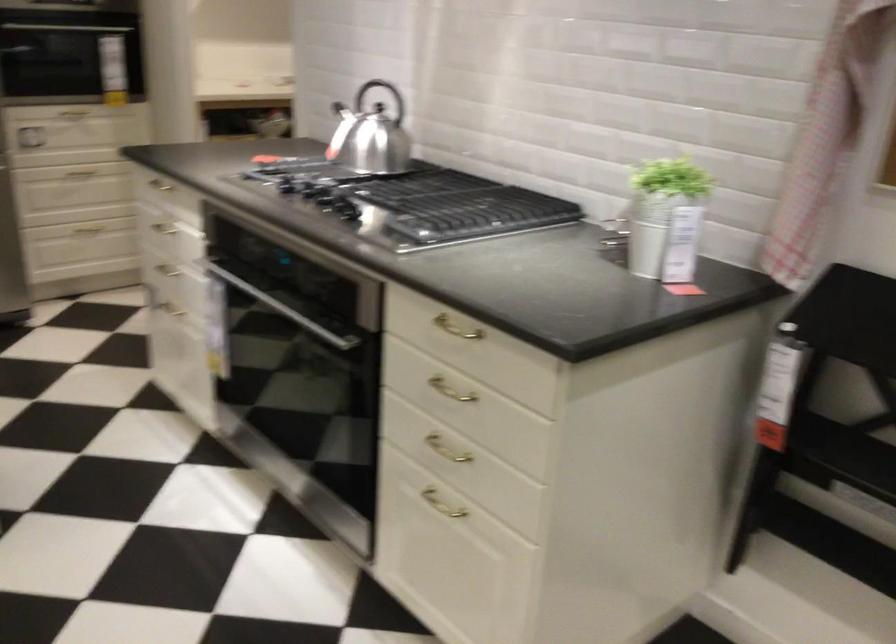
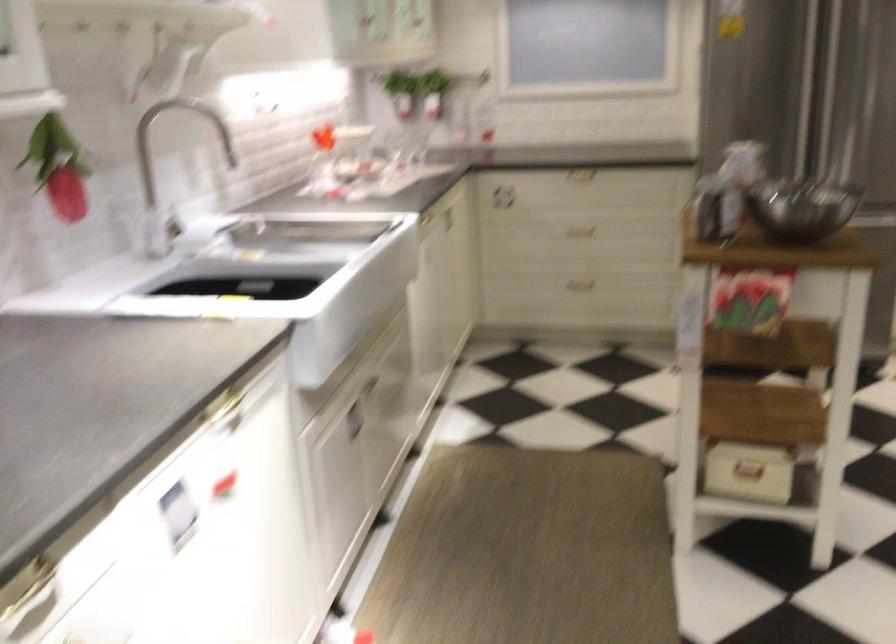
Question: How did the camera likely rotate?

Choices:
 (A) Left
 (B) Right
 (C) Up
 (D) Down

Answer: (A)